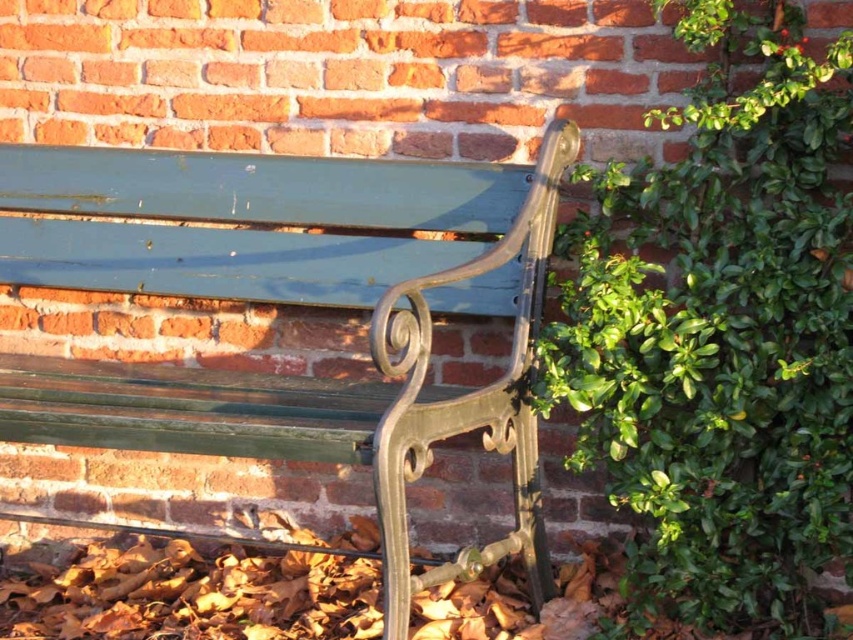
Does green leafy ivy at right have a greater height compared to green painted wood bench at center?

Correct, green leafy ivy at right is much taller as green painted wood bench at center.

Between green leafy ivy at right and green painted wood bench at center, which one has less height?

Standing shorter between the two is green painted wood bench at center.

Does point (578, 164) come behind point (64, 177)?

That is False.

Locate an element on the screen. The height and width of the screenshot is (640, 853). green leafy ivy at right is located at coordinates (721, 333).